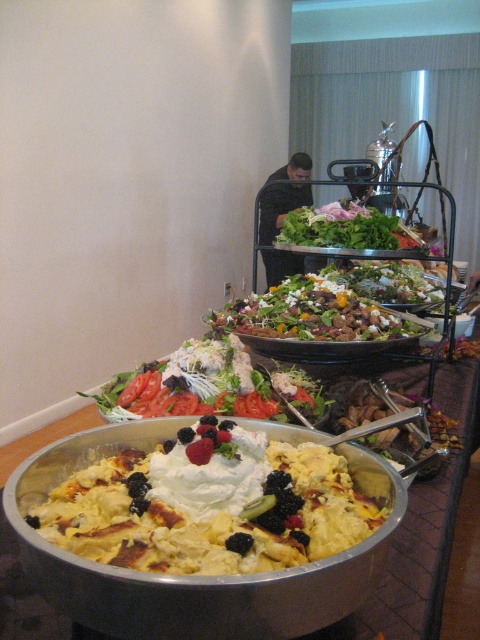
Is point (305, 392) positioned after point (346, 202)?

No, (305, 392) is in front of (346, 202).

At what (x,y) coordinates should I click in order to perform the action: click on fresh green salad at center. Please return your answer as a coordinate pair (x, y). Looking at the image, I should click on (191, 385).

At what (x,y) coordinates should I click in order to perform the action: click on fresh green salad at center. Please return your answer as a coordinate pair (x, y). This screenshot has height=640, width=480. Looking at the image, I should click on (191, 385).

Based on the photo, is metallic silver bowl at center below green leafy salad at center?

Yes.

Does point (202, 611) come closer to viewer compared to point (342, 230)?

Yes, point (202, 611) is in front of point (342, 230).

Image resolution: width=480 pixels, height=640 pixels. I want to click on metallic silver bowl at center, so click(196, 576).

Does fresh green salad at center come behind green leafymaterial/textureobject at center?

No, fresh green salad at center is in front of green leafymaterial/textureobject at center.

Does fresh green salad at center have a larger size compared to green leafymaterial/textureobject at center?

No.

Who is more distant from viewer, (x=124, y=412) or (x=387, y=308)?

The point (x=387, y=308) is behind.

Image resolution: width=480 pixels, height=640 pixels. What are the coordinates of `fresh green salad at center` in the screenshot? It's located at (191, 385).